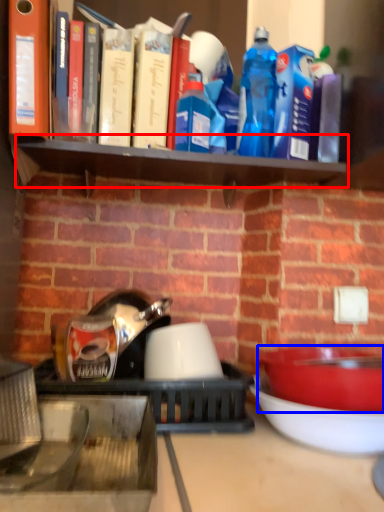
Question: Which object appears closest to the camera in this image, shelf (highlighted by a red box) or bowl (highlighted by a blue box)?

Choices:
 (A) shelf
 (B) bowl

Answer: (B)